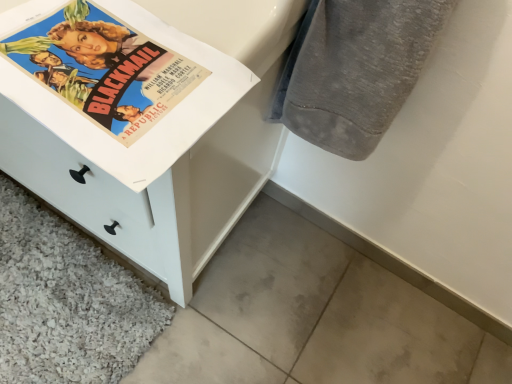
Where is `white matte chest of drawers at left`? The width and height of the screenshot is (512, 384). white matte chest of drawers at left is located at coordinates (180, 156).

In order to face white matte chest of drawers at left, should I rotate leftwards or rightwards?

Rotate your view left by about 24.482°.

What is the approximate height of white matte chest of drawers at left?

white matte chest of drawers at left is 93.12 centimeters tall.

Measure the distance between point (213, 140) and camera.

A distance of 25.63 inches exists between point (213, 140) and camera.

Describe the element at coordinates (180, 156) in the screenshot. I see `white matte chest of drawers at left` at that location.

Where is `gray cotton towel at upper right`? gray cotton towel at upper right is located at coordinates (355, 70).

Describe the element at coordinates (355, 70) in the screenshot. I see `gray cotton towel at upper right` at that location.

Where is `white matte chest of drawers at left`? white matte chest of drawers at left is located at coordinates (180, 156).

Between gray cotton towel at upper right and white matte chest of drawers at left, which one appears on the left side from the viewer's perspective?

white matte chest of drawers at left.

From the picture: Does gray cotton towel at upper right come behind white matte chest of drawers at left?

Yes, the depth of gray cotton towel at upper right is greater than that of white matte chest of drawers at left.

Which is closer to the camera, (417, 28) or (5, 146)?

Point (417, 28) appears to be closer to the viewer than point (5, 146).

From the image's perspective, is gray cotton towel at upper right beneath white matte chest of drawers at left?

Yes, from the image's perspective, gray cotton towel at upper right is below white matte chest of drawers at left.

From a real-world perspective, is gray cotton towel at upper right positioned above or below white matte chest of drawers at left?

gray cotton towel at upper right is situated higher than white matte chest of drawers at left in the real world.

Which of these two, gray cotton towel at upper right or white matte chest of drawers at left, is thinner?

gray cotton towel at upper right is thinner.

Is gray cotton towel at upper right shorter than white matte chest of drawers at left?

Correct, gray cotton towel at upper right is not as tall as white matte chest of drawers at left.

Considering the sizes of objects gray cotton towel at upper right and white matte chest of drawers at left in the image provided, who is smaller, gray cotton towel at upper right or white matte chest of drawers at left?

Smaller between the two is gray cotton towel at upper right.

Is white matte chest of drawers at left inside gray cotton towel at upper right?

Actually, white matte chest of drawers at left is outside gray cotton towel at upper right.

Would you consider gray cotton towel at upper right to be distant from white matte chest of drawers at left?

No, gray cotton towel at upper right is in close proximity to white matte chest of drawers at left.

From the picture: Is gray cotton towel at upper right facing away from white matte chest of drawers at left?

gray cotton towel at upper right does not have its back to white matte chest of drawers at left.

How many degrees apart are the facing directions of gray cotton towel at upper right and white matte chest of drawers at left?

The facing directions of gray cotton towel at upper right and white matte chest of drawers at left are 1.44 degrees apart.

Where is `chest of drawers above the gray cotton towel at upper right (from the image's perspective)`? The width and height of the screenshot is (512, 384). chest of drawers above the gray cotton towel at upper right (from the image's perspective) is located at coordinates (180, 156).

Is white matte chest of drawers at left to the left of gray cotton towel at upper right from the viewer's perspective?

Yes.

Looking at this image, considering the positions of objects white matte chest of drawers at left and gray cotton towel at upper right in the image provided, who is in front, white matte chest of drawers at left or gray cotton towel at upper right?

Positioned in front is white matte chest of drawers at left.

Which is in front, point (169, 210) or point (425, 4)?

The point (425, 4) is in front.

From the image's perspective, between white matte chest of drawers at left and gray cotton towel at upper right, who is located below?

gray cotton towel at upper right, from the image's perspective.

From a real-world perspective, is white matte chest of drawers at left positioned over gray cotton towel at upper right based on gravity?

No, from a real-world perspective, white matte chest of drawers at left is not above gray cotton towel at upper right.

Can you confirm if white matte chest of drawers at left is thinner than gray cotton towel at upper right?

In fact, white matte chest of drawers at left might be wider than gray cotton towel at upper right.

Considering the relative sizes of white matte chest of drawers at left and gray cotton towel at upper right in the image provided, is white matte chest of drawers at left shorter than gray cotton towel at upper right?

No, white matte chest of drawers at left is not shorter than gray cotton towel at upper right.

Can you confirm if white matte chest of drawers at left is bigger than gray cotton towel at upper right?

Yes, white matte chest of drawers at left is bigger than gray cotton towel at upper right.

Is white matte chest of drawers at left inside or outside of gray cotton towel at upper right?

white matte chest of drawers at left cannot be found inside gray cotton towel at upper right.

Is white matte chest of drawers at left next to gray cotton towel at upper right and touching it?

No, white matte chest of drawers at left is not in contact with gray cotton towel at upper right.

Is gray cotton towel at upper right at the back of white matte chest of drawers at left?

white matte chest of drawers at left is not turned away from gray cotton towel at upper right.

In the image, there is a white matte chest of drawers at left. At what (x,y) coordinates should I click in order to perform the action: click on bath towel below it (from the image's perspective). Please return your answer as a coordinate pair (x, y). Looking at the image, I should click on (355, 70).

I want to click on bath towel above the white matte chest of drawers at left (from a real-world perspective), so click(355, 70).

The height and width of the screenshot is (384, 512). I want to click on chest of drawers on the left of gray cotton towel at upper right, so click(180, 156).